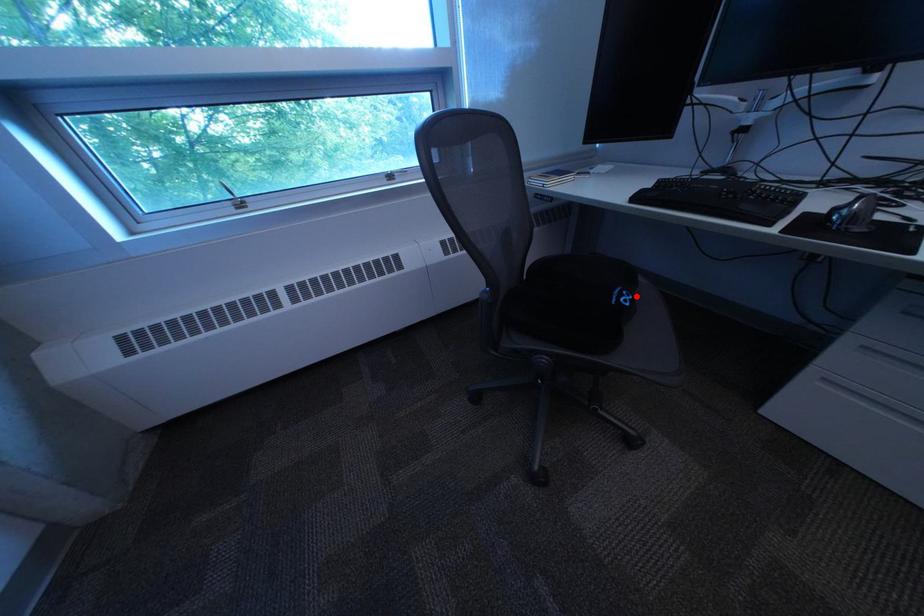
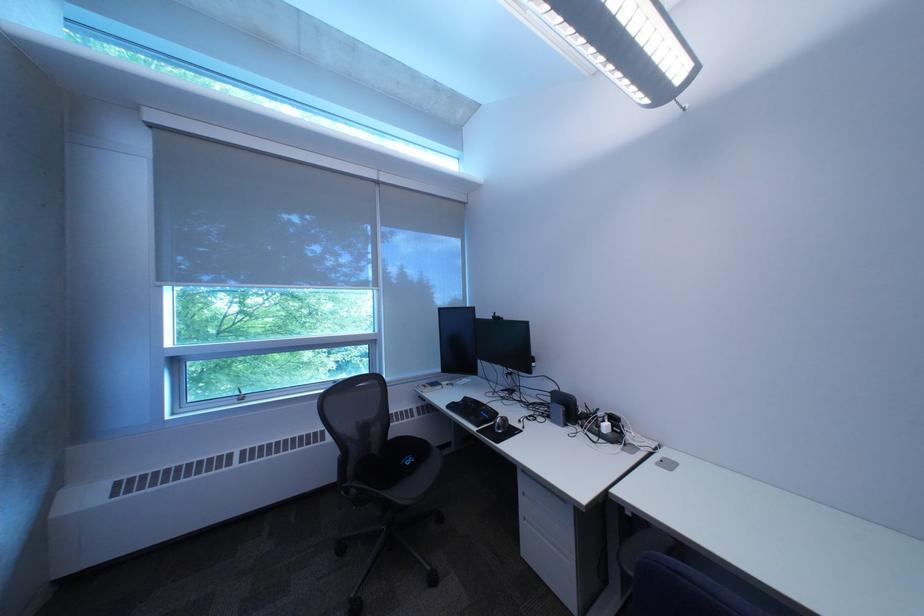
Find the pixel in the second image that matches the highlighted location in the first image.

(423, 461)